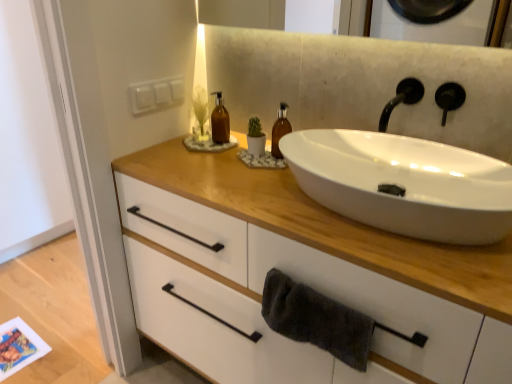
Identify the location of vacant space situated on the left part of translucent amber bottle at center, which is the second bottle in left-to-right order. (217, 162).